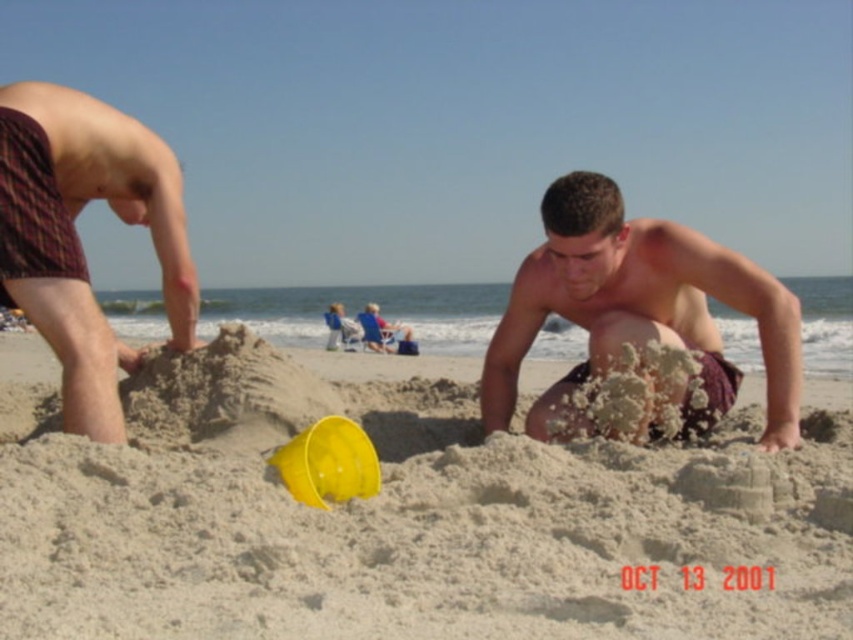
From the picture: Based on the scene described, what is located at the coordinates point (401,516)?

The beige sand at center is located at point (401,516).

You are standing on the beach and see two points marked on the sand. The first point is at coordinate point (495, 474) and the second is at point (90, 404). If you walk towards the ocean from your current position, which point will you step on first?

Point (495, 474) is in front of point (90, 404), so you will step on point (495, 474) first when walking towards the ocean.

You are standing at the beach and want to take a photo of the two points marked in the scene. Which point, point 1 at coordinates (734,465) or point 2 at coordinates (708,323), will appear larger in your camera view?

Point 1 at coordinates (734,465) will appear larger in the camera view because it is closer to the camera than point 2 at coordinates (708,323).